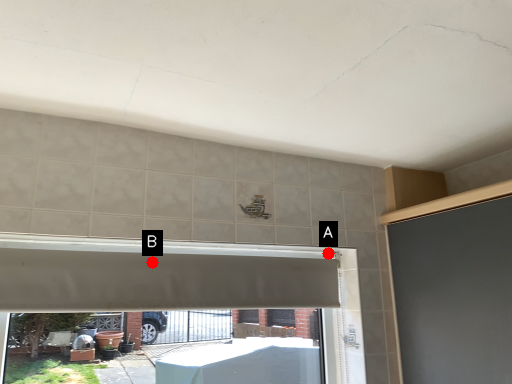
Question: Two points are circled on the image, labeled by A and B beside each circle. Which point appears closest to the camera in this image?

Choices:
 (A) A is closer
 (B) B is closer

Answer: (B)